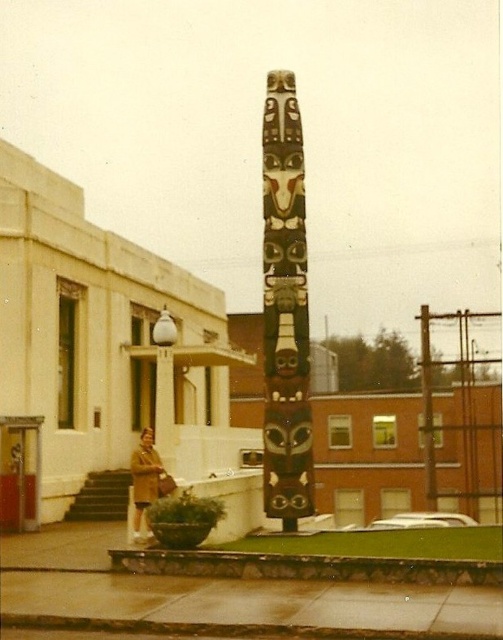
Question: Is carved wood totem pole at center behind brown leather coat at lower left?

Choices:
 (A) no
 (B) yes

Answer: (B)

Question: Can you confirm if carved wood totem pole at center is bigger than brown leather coat at lower left?

Choices:
 (A) yes
 (B) no

Answer: (A)

Question: Considering the relative positions of carved wood totem pole at center and brown leather coat at lower left in the image provided, where is carved wood totem pole at center located with respect to brown leather coat at lower left?

Choices:
 (A) above
 (B) below

Answer: (A)

Question: Which object is closer to the camera taking this photo?

Choices:
 (A) brown leather coat at lower left
 (B) carved wood totem pole at center

Answer: (A)

Question: Which of the following is the closest to the observer?

Choices:
 (A) brown leather coat at lower left
 (B) carved wood totem pole at center

Answer: (A)